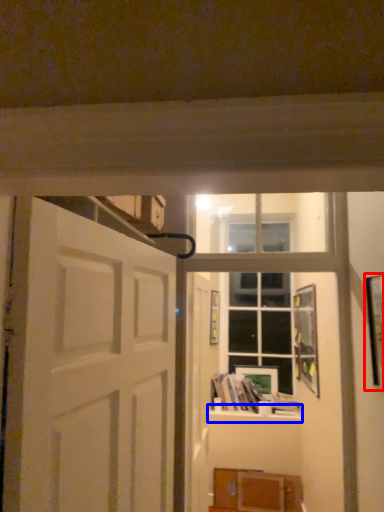
Question: Which object appears closest to the camera in this image, picture frame (highlighted by a red box) or window sill (highlighted by a blue box)?

Choices:
 (A) picture frame
 (B) window sill

Answer: (A)